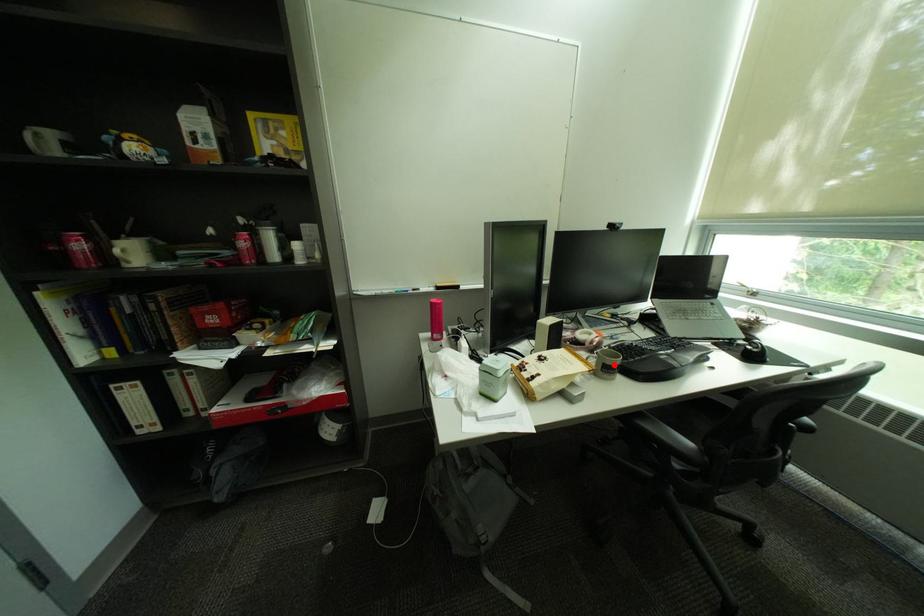
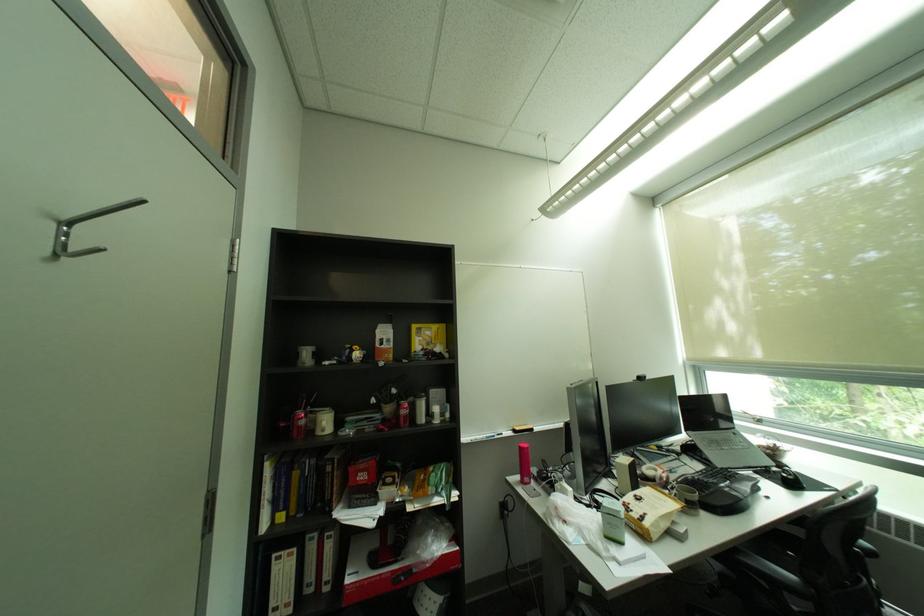
Find the pixel in the second image that matches the highlighted location in the first image.

(697, 500)